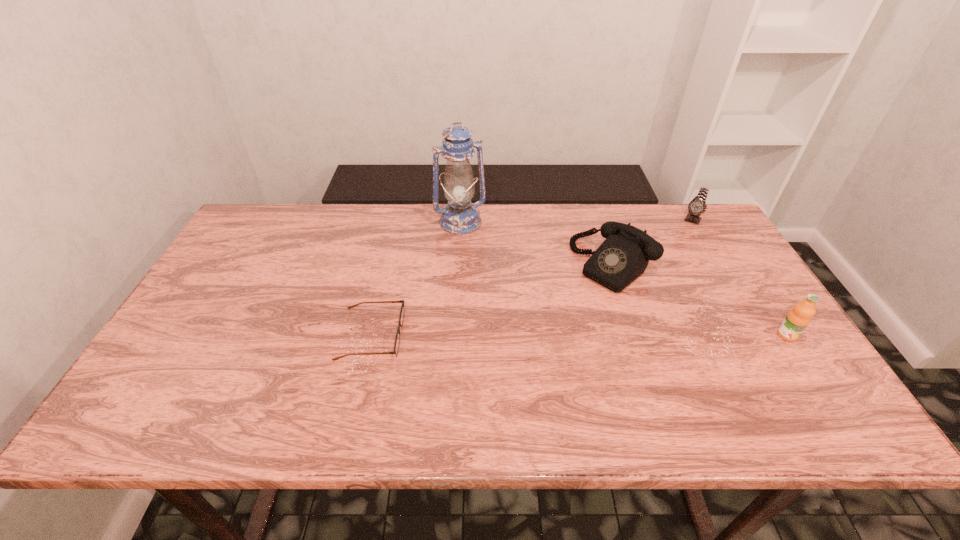
This screenshot has width=960, height=540. I want to click on vacant space on the desktop that is between the leftmost object and the orange juice and is positioned on the dial of the third object from right to left, so click(536, 335).

Find the location of a particular element. vacant space on the desktop that is between the shortest object and the rightmost object and is positioned on the front-facing side of the tallest object is located at coordinates (518, 335).

Locate an element on the screen. free space on the desktop that is between the shortest object and the orange juice and is positioned on the face of the second object from right to left is located at coordinates (633, 335).